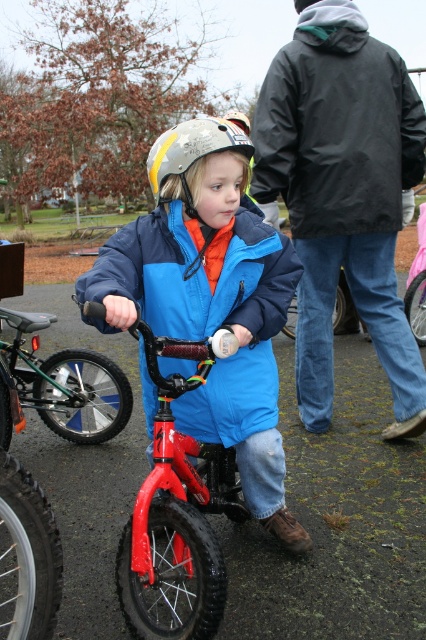
You are a photographer trying to capture the child riding the bicycle. To get a clear shot of both the matte blue jacket at center and the red matte bicycle at center, which object should you position your camera to the left of?

You should position your camera to the left of the matte blue jacket at center because it is to the right of the red matte bicycle at center, so placing the camera to the left of the jacket will ensure both objects are in frame.

Please provide the 2D coordinates of the matte blue jacket at center in the image. The coordinates should be in the format of a point with two decimal places, like this example format point_x, point_y. The answer should be in the form of a point with two decimal places, like this example format point_x, point_y. The answer should be in the form of a point with two decimal places, like this example format point_x, point_y. The answer should be in the form of a point with two decimal places, like this example

The 2D coordinates of the matte blue jacket at center are at point [210,298].

You are a parent trying to choose between two bicycles for your child. The shiny red bicycle at center and the metallic silver bicycle at center are both in front of you. Based on their height, which bicycle would be more suitable for a child who needs a bike with a lower seat to reach the ground easily?

The metallic silver bicycle at center is shorter than the shiny red bicycle at center. Since the child needs a bike with a lower seat to reach the ground easily, the metallic silver bicycle at center would be more suitable.